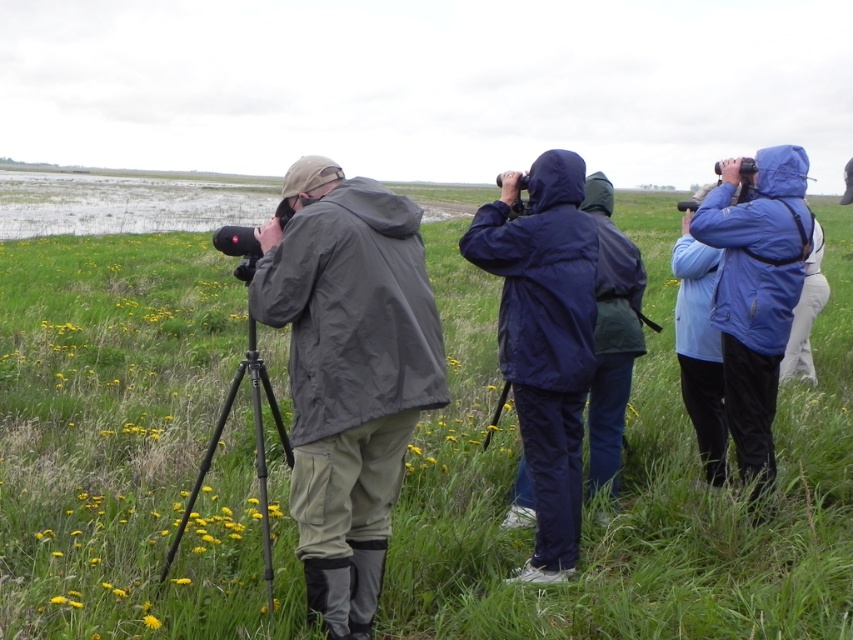
Does matte black jacket at center appear on the left side of black matte tripod at center?

In fact, matte black jacket at center is to the right of black matte tripod at center.

Is point (300, 512) behind point (282, 440)?

No, (300, 512) is in front of (282, 440).

Who is more forward, (410, 433) or (181, 524)?

Point (410, 433) is more forward.

The height and width of the screenshot is (640, 853). Identify the location of matte black jacket at center. (347, 371).

Between green grassy at center and navy blue raincoat at center, which one is positioned higher?

Positioned higher is green grassy at center.

Between green grassy at center and navy blue raincoat at center, which one is positioned lower?

navy blue raincoat at center is lower down.

Is point (666, 369) positioned after point (526, 374)?

Yes, point (666, 369) is farther from viewer.

This screenshot has width=853, height=640. Find the location of `green grassy at center`. green grassy at center is located at coordinates (625, 486).

Is blue matte jacket at right bigger than black matte tripod at center?

No, blue matte jacket at right is not bigger than black matte tripod at center.

Does blue matte jacket at right have a greater width compared to black matte tripod at center?

No.

Which is behind, point (724, 397) or point (248, 364)?

Positioned behind is point (724, 397).

Identify the location of blue matte jacket at right. (756, 292).